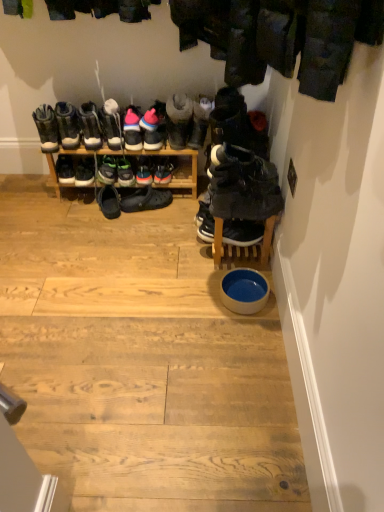
This screenshot has width=384, height=512. I want to click on vacant region to the left of blue ceramic bowl at center, so click(197, 310).